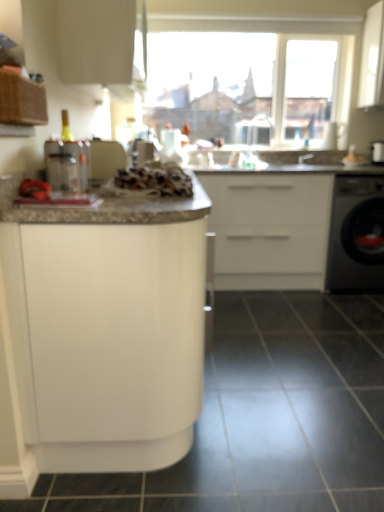
Question: Considering the relative positions of white matte cabinet at center, placed as the 2th cabinetry when sorted from top to bottom, and white glossy cabinet at upper center, which is counted as the 1th cabinetry, starting from the top, in the image provided, is white matte cabinet at center, placed as the 2th cabinetry when sorted from top to bottom, to the right of white glossy cabinet at upper center, which is counted as the 1th cabinetry, starting from the top, from the viewer's perspective?

Choices:
 (A) yes
 (B) no

Answer: (A)

Question: From a real-world perspective, is white matte cabinet at center, placed as the 2th cabinetry when sorted from bottom to top, below white glossy cabinet at upper center, which is counted as the 1th cabinetry, starting from the top?

Choices:
 (A) yes
 (B) no

Answer: (A)

Question: Is white matte cabinet at center, placed as the 2th cabinetry when sorted from bottom to top, further to the viewer compared to white glossy cabinet at upper center, positioned as the third cabinetry in bottom-to-top order?

Choices:
 (A) no
 (B) yes

Answer: (B)

Question: Is white matte cabinet at center, placed as the 2th cabinetry when sorted from top to bottom, bigger than white glossy cabinet at upper center, which is counted as the 1th cabinetry, starting from the top?

Choices:
 (A) yes
 (B) no

Answer: (A)

Question: Is white matte cabinet at center, placed as the 2th cabinetry when sorted from bottom to top, next to white glossy cabinet at upper center, which is counted as the 1th cabinetry, starting from the top, and touching it?

Choices:
 (A) yes
 (B) no

Answer: (B)

Question: Can we say white matte cabinet at center, placed as the 2th cabinetry when sorted from top to bottom, lies outside white glossy cabinet at upper center, positioned as the third cabinetry in bottom-to-top order?

Choices:
 (A) yes
 (B) no

Answer: (A)

Question: Is white glossy cabinet at upper center, which is counted as the 1th cabinetry, starting from the top, oriented towards white textured bread at center?

Choices:
 (A) yes
 (B) no

Answer: (B)

Question: Does white glossy cabinet at upper center, which is counted as the 1th cabinetry, starting from the top, lie behind white textured bread at center?

Choices:
 (A) no
 (B) yes

Answer: (B)

Question: Is white glossy cabinet at upper center, which is counted as the 1th cabinetry, starting from the top, outside of white textured bread at center?

Choices:
 (A) yes
 (B) no

Answer: (A)

Question: Is white glossy cabinet at upper center, positioned as the third cabinetry in bottom-to-top order, wider than white textured bread at center?

Choices:
 (A) no
 (B) yes

Answer: (A)

Question: Can you confirm if white glossy cabinet at upper center, which is counted as the 1th cabinetry, starting from the top, is positioned to the right of white textured bread at center?

Choices:
 (A) no
 (B) yes

Answer: (A)

Question: Is white glossy cabinet at upper center, which is counted as the 1th cabinetry, starting from the top, with white textured bread at center?

Choices:
 (A) yes
 (B) no

Answer: (B)

Question: Is black glossy tile at lower center to the right of clear plastic faucet at upper center, positioned as the second faucet in right-to-left order, from the viewer's perspective?

Choices:
 (A) yes
 (B) no

Answer: (A)